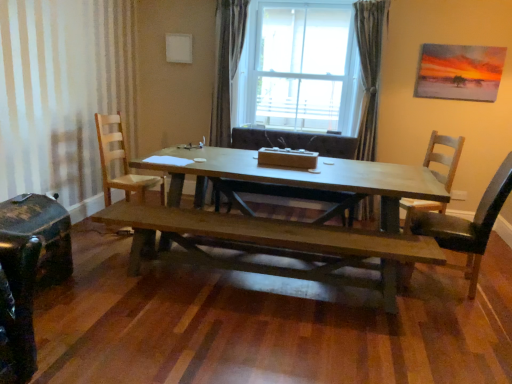
Question: Would you say wooden chair at right, which is counted as the third chair, starting from the left, contains satin fabric curtain at center, the 2th curtain when ordered from right to left?

Choices:
 (A) yes
 (B) no

Answer: (B)

Question: From the image's perspective, is wooden chair at right, which is counted as the third chair, starting from the left, under satin fabric curtain at center, the 2th curtain when ordered from right to left?

Choices:
 (A) yes
 (B) no

Answer: (A)

Question: Is wooden chair at right, the 2th chair when ordered from right to left, to the right of satin fabric curtain at center, which is the first curtain in left-to-right order, from the viewer's perspective?

Choices:
 (A) no
 (B) yes

Answer: (B)

Question: Is the surface of wooden chair at right, which is counted as the third chair, starting from the left, in direct contact with satin fabric curtain at center, the 2th curtain when ordered from right to left?

Choices:
 (A) yes
 (B) no

Answer: (B)

Question: From the image's perspective, is wooden chair at right, which is counted as the third chair, starting from the left, over satin fabric curtain at center, the 2th curtain when ordered from right to left?

Choices:
 (A) yes
 (B) no

Answer: (B)

Question: From a real-world perspective, is satin fabric curtain at center, the 2th curtain when ordered from right to left, positioned above or below shiny black suitcase at lower left?

Choices:
 (A) below
 (B) above

Answer: (B)

Question: Considering their positions, is satin fabric curtain at center, which is the first curtain in left-to-right order, located in front of or behind shiny black suitcase at lower left?

Choices:
 (A) front
 (B) behind

Answer: (B)

Question: Looking at their shapes, would you say satin fabric curtain at center, which is the first curtain in left-to-right order, is wider or thinner than shiny black suitcase at lower left?

Choices:
 (A) wide
 (B) thin

Answer: (B)

Question: Which is correct: satin fabric curtain at center, which is the first curtain in left-to-right order, is inside shiny black suitcase at lower left, or outside of it?

Choices:
 (A) outside
 (B) inside

Answer: (A)

Question: Is wooden chair at center, the 2th chair in the left-to-right sequence, in front of or behind dark brown wooden bench at center in the image?

Choices:
 (A) front
 (B) behind

Answer: (B)

Question: In terms of height, does wooden chair at center, the 2th chair in the left-to-right sequence, look taller or shorter compared to dark brown wooden bench at center?

Choices:
 (A) short
 (B) tall

Answer: (B)

Question: Considering the positions of point (312, 195) and point (144, 251), is point (312, 195) closer or farther from the camera than point (144, 251)?

Choices:
 (A) farther
 (B) closer

Answer: (A)

Question: Would you say wooden chair at center, placed as the third chair when sorted from right to left, is to the left or to the right of dark brown wooden bench at center in the picture?

Choices:
 (A) right
 (B) left

Answer: (A)

Question: In terms of width, does wooden chair at right, which is counted as the third chair, starting from the left, look wider or thinner when compared to light brown wooden chair at left, acting as the 1th chair starting from the left?

Choices:
 (A) thin
 (B) wide

Answer: (B)

Question: From the image's perspective, is wooden chair at right, which is counted as the third chair, starting from the left, located above or below light brown wooden chair at left, acting as the 1th chair starting from the left?

Choices:
 (A) below
 (B) above

Answer: (A)